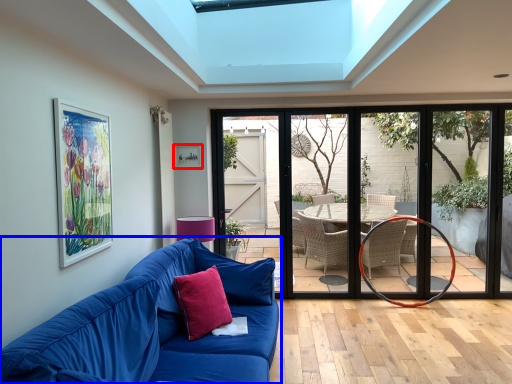
Question: Which point is closer to the camera, picture frame (highlighted by a red box) or studio couch (highlighted by a blue box)?

Choices:
 (A) picture frame
 (B) studio couch

Answer: (B)